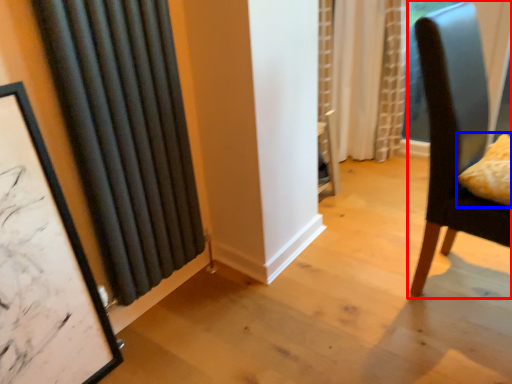
Question: Which object appears farthest to the camera in this image, chair (highlighted by a red box) or pillow (highlighted by a blue box)?

Choices:
 (A) chair
 (B) pillow

Answer: (B)